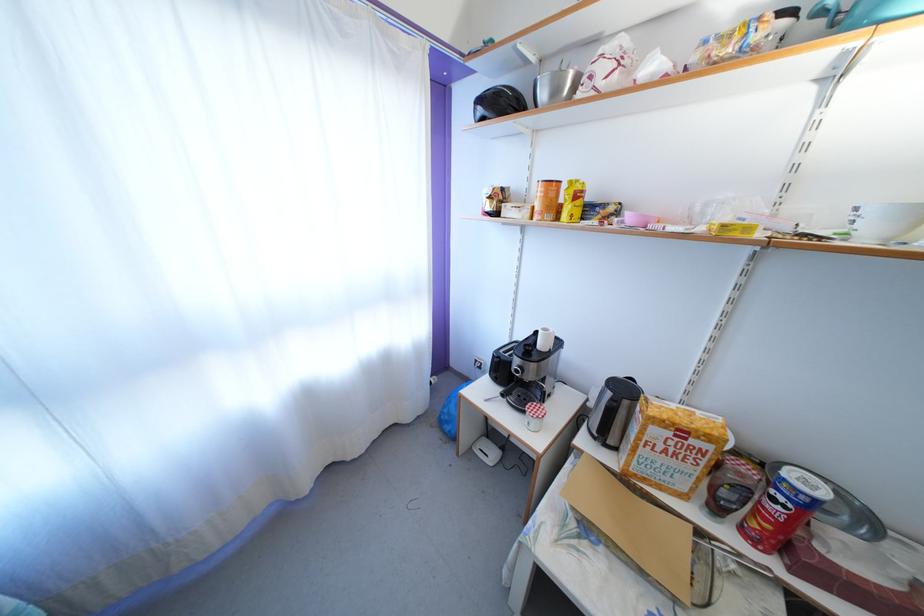
Where would you lift the blue plastic bag? Please return your answer as a coordinate pair (x, y).

(450, 411)